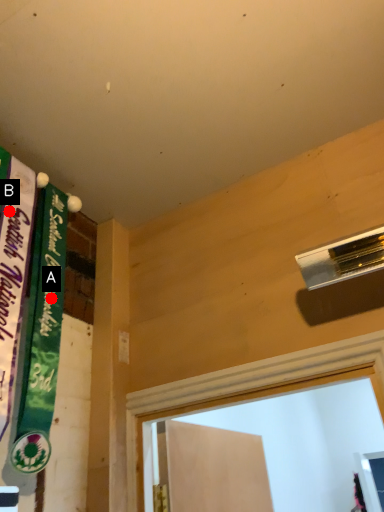
Question: Two points are circled on the image, labeled by A and B beside each circle. Which point is further to the camera?

Choices:
 (A) A is further
 (B) B is further

Answer: (A)